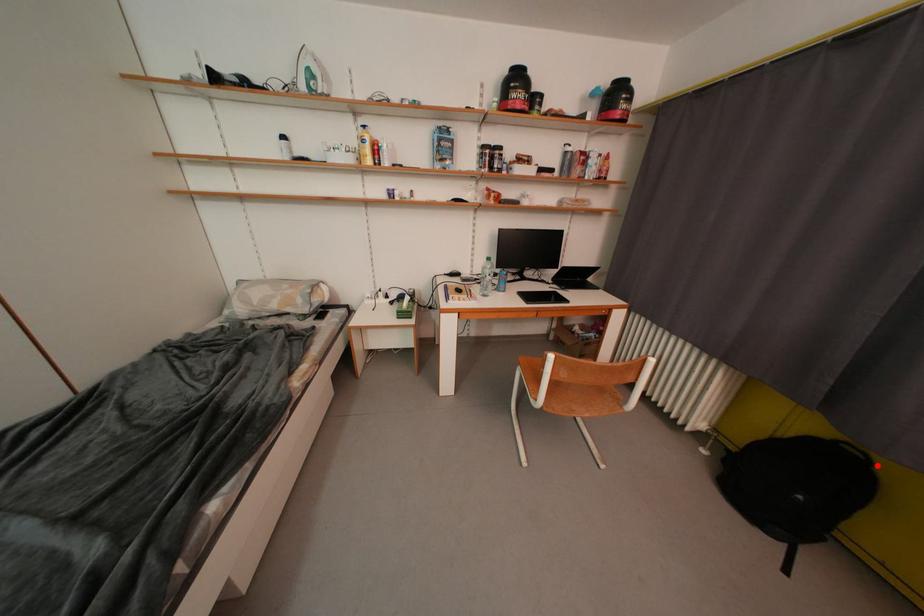
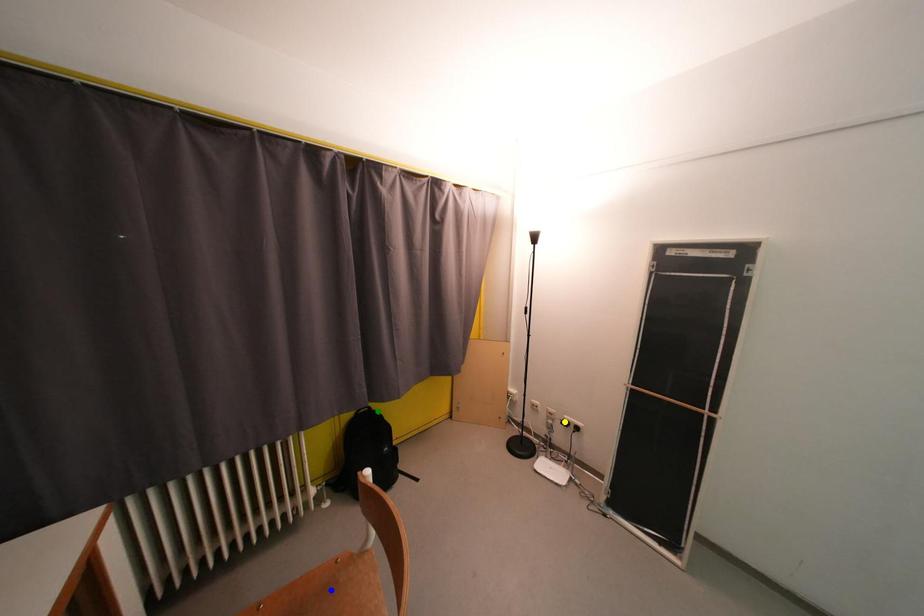
Question: I am providing you with two images of the same scene from different viewpoints. A red point is marked on the first image. You are given multiple points on the second image. Can you choose the point in image 2 that corresponds to the point in image 1?

Choices:
 (A) yellow point
 (B) blue point
 (C) green point

Answer: (C)